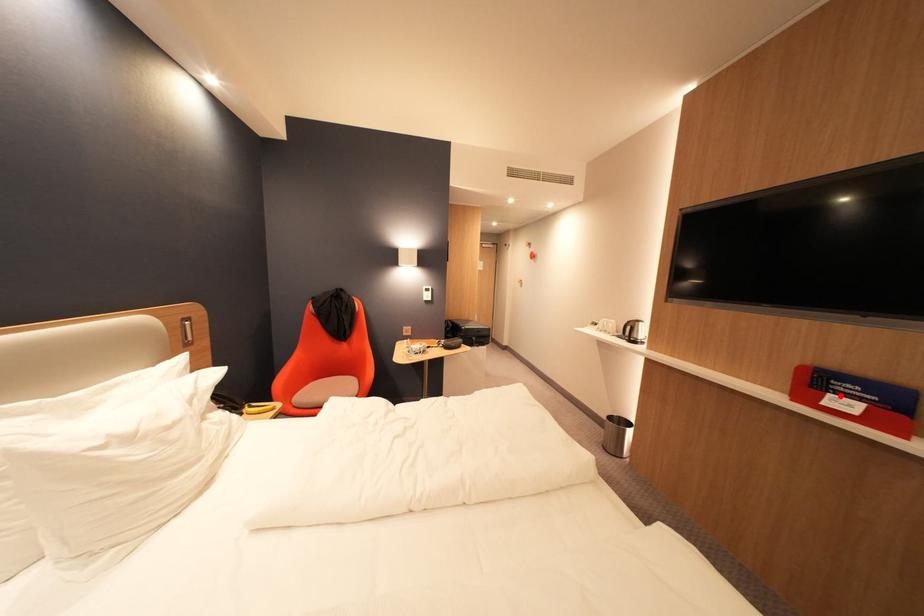
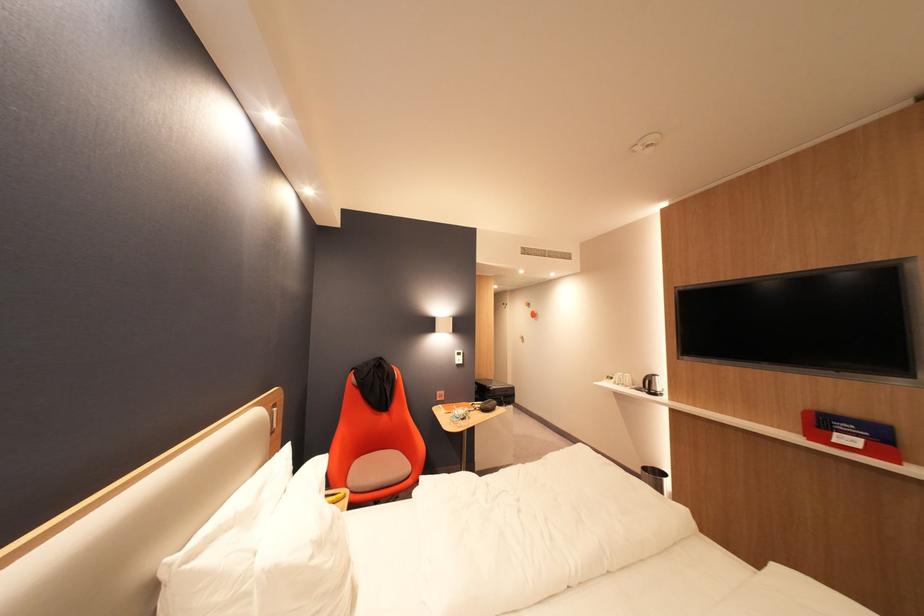
Locate, in the second image, the point that corresponds to the highlighted location in the first image.

(846, 435)